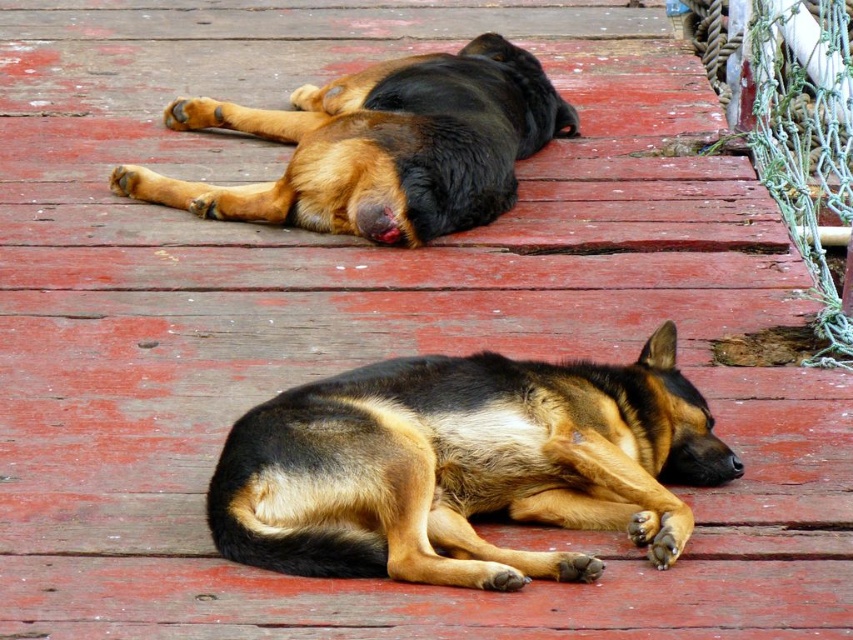
You are standing at the edge of the deck and want to approach the black and tan fur dog at center. Based on its position coordinates, which direction should you move to reach it?

The black and tan fur dog at center is located at coordinates point [463,467], so you should move towards the center of the deck to reach it.